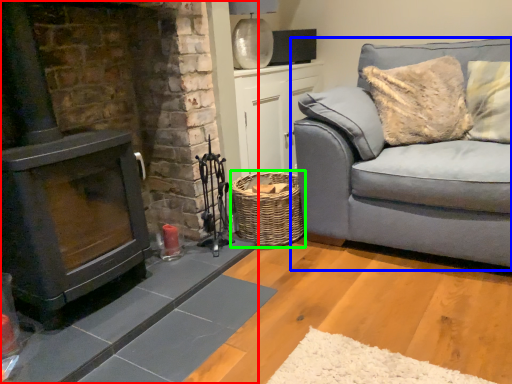
Question: Estimate the real-world distances between objects in this image. Which object is closer to fireplace (highlighted by a red box), studio couch (highlighted by a blue box) or basket (highlighted by a green box)?

Choices:
 (A) studio couch
 (B) basket

Answer: (B)